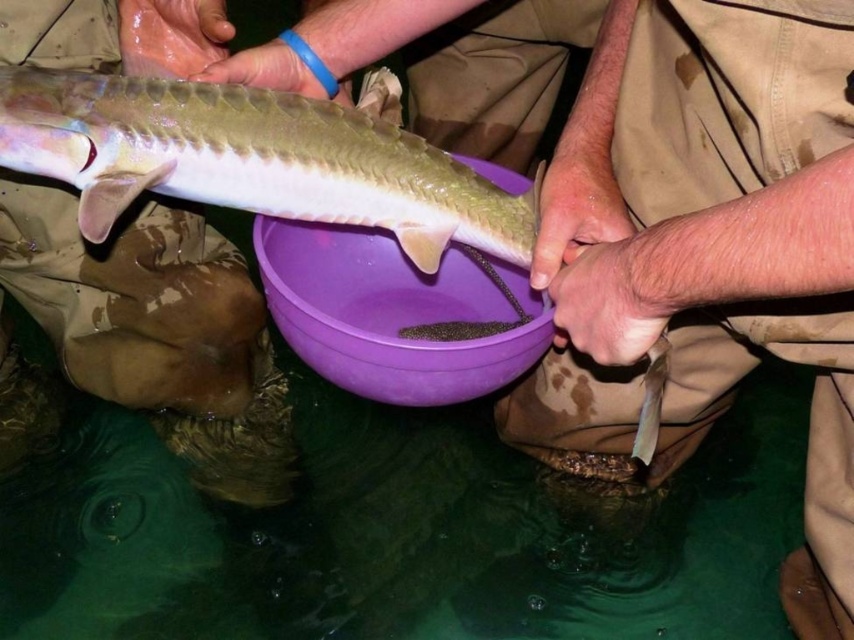
Is smooth beige pants at upper left taller than shiny silver fish at center?

Correct, smooth beige pants at upper left is much taller as shiny silver fish at center.

Who is positioned more to the right, smooth beige pants at upper left or shiny silver fish at center?

From the viewer's perspective, shiny silver fish at center appears more on the right side.

Does point (176, 36) lie in front of point (285, 136)?

No, (176, 36) is behind (285, 136).

The height and width of the screenshot is (640, 854). I want to click on smooth beige pants at upper left, so click(155, 330).